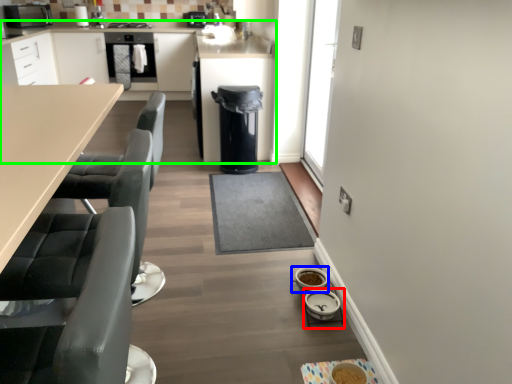
Question: Considering the real-world distances, which object is closest to appliance (highlighted by a red box)? appliance (highlighted by a blue box) or cabinetry (highlighted by a green box).

Choices:
 (A) appliance
 (B) cabinetry

Answer: (A)